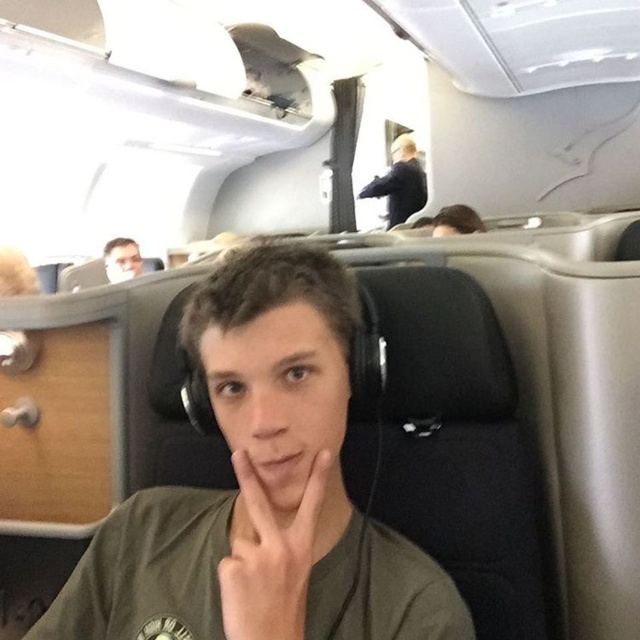
Which is above, matte green shirt at center or matte black headphones at center?

matte black headphones at center is above.

The height and width of the screenshot is (640, 640). In order to click on matte green shirt at center in this screenshot , I will do `click(260, 490)`.

Who is more distant from viewer, (257, 474) or (124, 262)?

The point (124, 262) is more distant.

Which is in front, point (227, 621) or point (128, 273)?

Point (227, 621) is in front.

Is point (268, 547) positioned before point (125, 256)?

That is True.

The image size is (640, 640). Find the location of `matte black headphones at center`. matte black headphones at center is located at coordinates (269, 556).

Does point (308, 516) come in front of point (392, 208)?

Yes, point (308, 516) is in front of point (392, 208).

Based on the photo, who is more forward, (403,545) or (403,198)?

Point (403,545) is more forward.

Where is `matte green shirt at center`? The height and width of the screenshot is (640, 640). matte green shirt at center is located at coordinates [x=260, y=490].